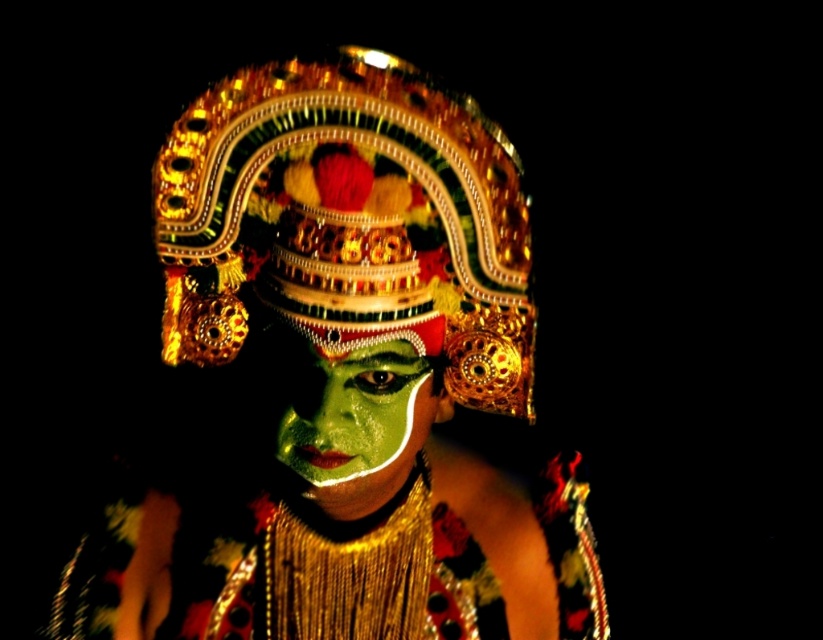
Which is in front, point (133, 572) or point (335, 481)?

Positioned in front is point (335, 481).

Can you confirm if green matte face paint at center is positioned below green matte face at center?

No, green matte face paint at center is not below green matte face at center.

What do you see at coordinates (342, 380) in the screenshot? This screenshot has width=823, height=640. I see `green matte face paint at center` at bounding box center [342, 380].

The width and height of the screenshot is (823, 640). What are the coordinates of `green matte face paint at center` in the screenshot? It's located at (342, 380).